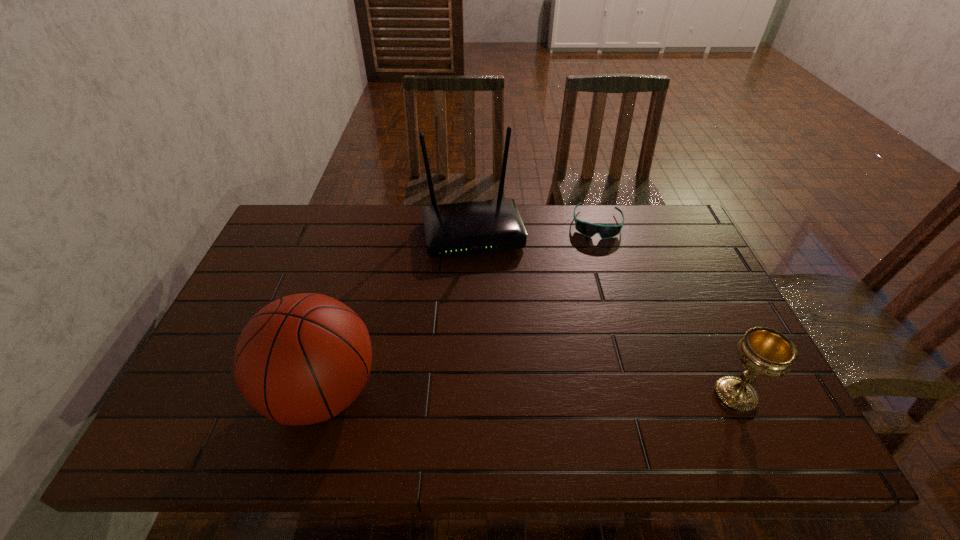
This screenshot has width=960, height=540. In order to click on free space on the desktop that is between the leftmost object and the rightmost object and is positioned on the front-facing side of the third object from right to left in this screenshot , I will do `click(513, 394)`.

Identify the location of vacant space on the desktop that is between the basketball and the rightmost object and is positioned on the front-facing side of the second object from right to left. The image size is (960, 540). (589, 395).